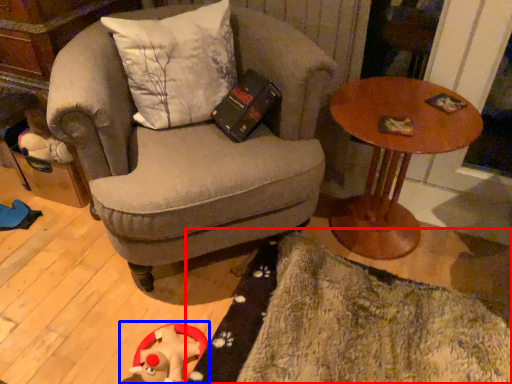
Question: Which object appears closest to the camera in this image, mat (highlighted by a red box) or toy (highlighted by a blue box)?

Choices:
 (A) mat
 (B) toy

Answer: (A)